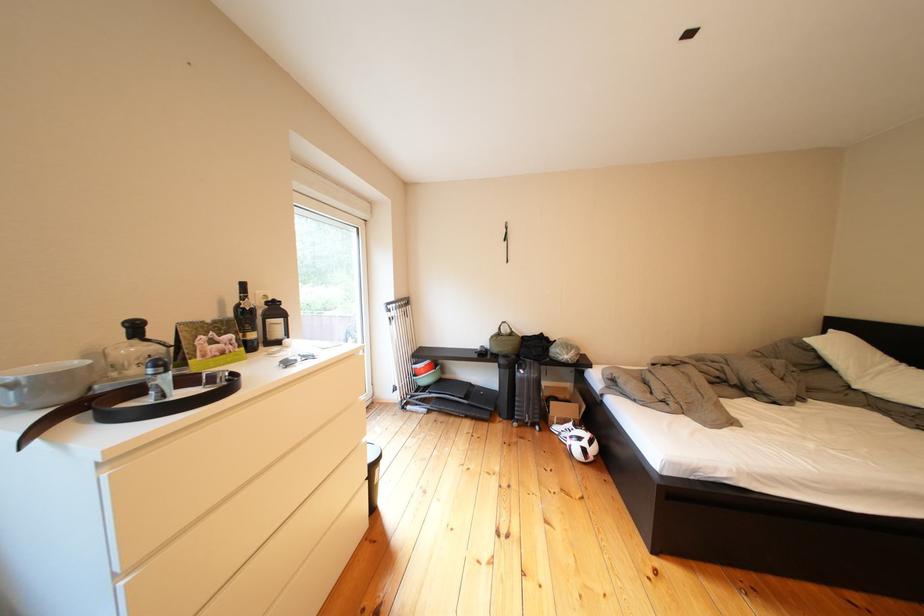
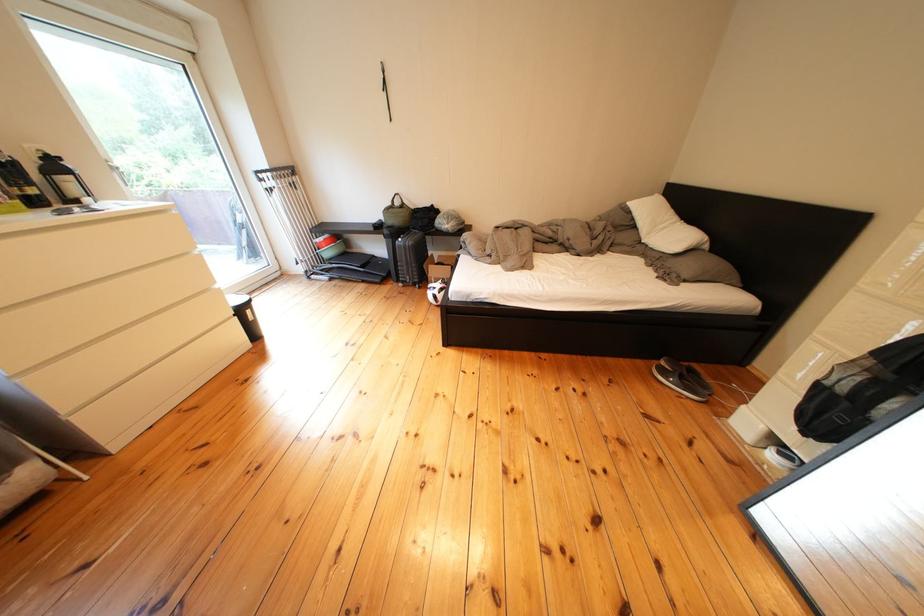
In the second image, find the point that corresponds to point (840, 371) in the first image.

(649, 230)